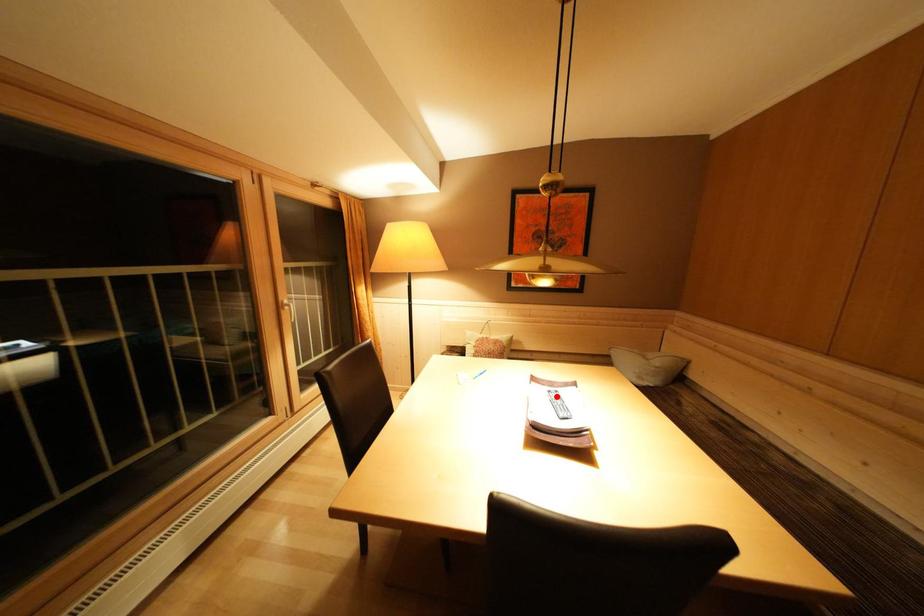
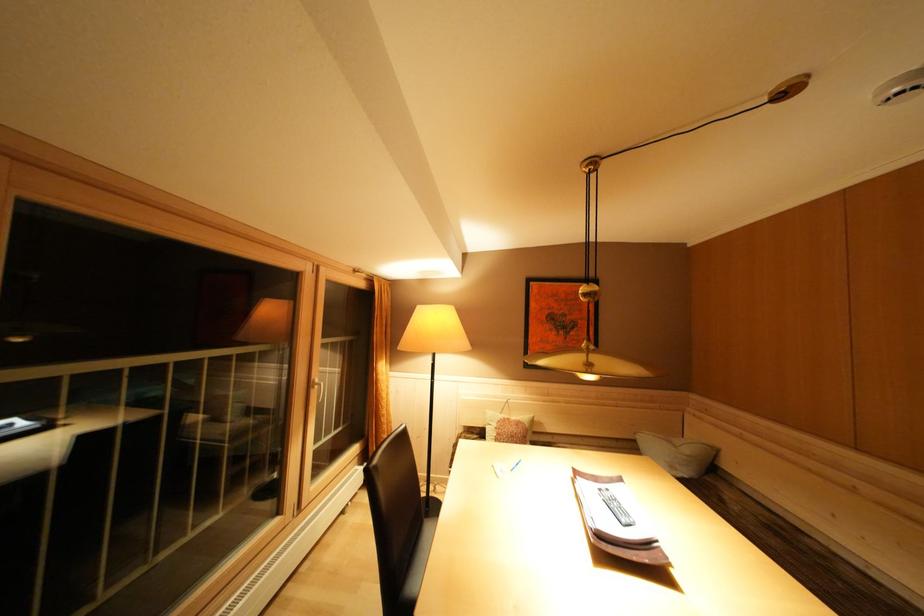
Find the pixel in the second image that matches the highlighted location in the first image.

(608, 495)